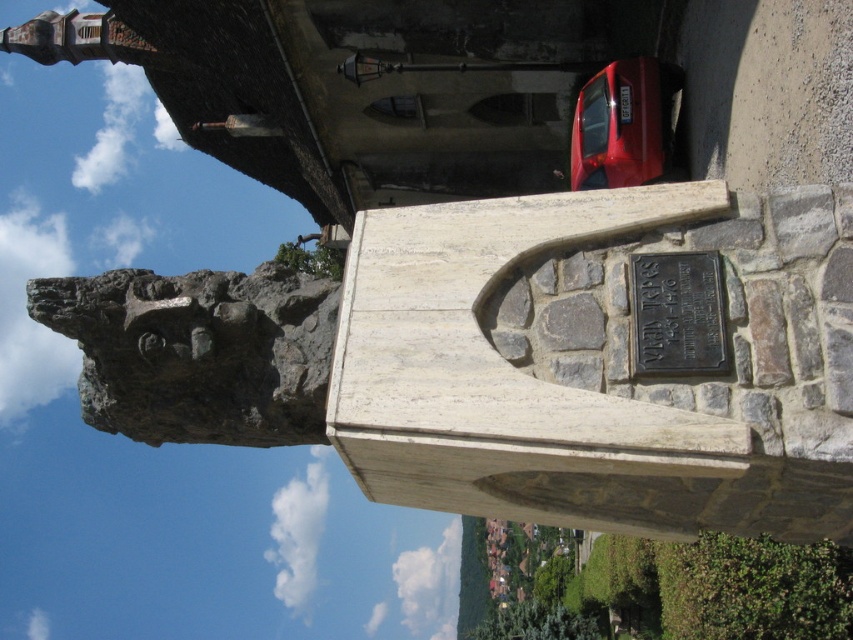
You are standing in front of the stone monument and want to take a photo of both the rough gray rock at upper left and the shiny red car at right. Which object should you focus on first to ensure both are in clear view?

You should focus on the rough gray rock at upper left first because it is closer to you than the shiny red car at right, so adjusting focus from near to far will help both be in clear view.

You are a photographer standing in front of the monument. You want to capture both the shiny red car at right and the black metal plaque at center in your photo. Which object should you position closer to the left side of the frame to include both in the shot?

To include both the shiny red car at right and the black metal plaque at center in the shot, you should position the black metal plaque at center closer to the left side of the frame since the shiny red car at right is located to the right of it.